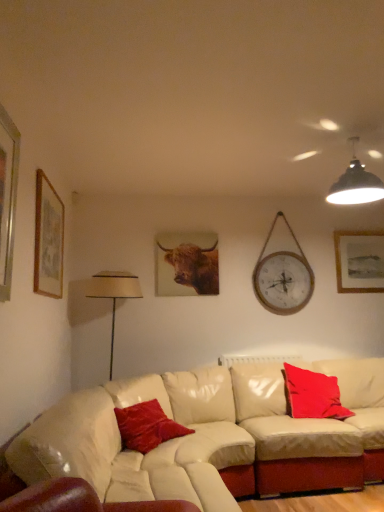
Question: From a real-world perspective, is velvet red pillow at center, which is the 2th pillow in right-to-left order, above or below silver metallic picture frame at left, placed as the second picture frame when sorted from left to right?

Choices:
 (A) below
 (B) above

Answer: (A)

Question: Looking at their shapes, would you say velvet red pillow at center, which is the 2th pillow in right-to-left order, is wider or thinner than silver metallic picture frame at left, positioned as the 3th picture frame in back-to-front order?

Choices:
 (A) wide
 (B) thin

Answer: (A)

Question: Which is farther from the brown furry cow at center?

Choices:
 (A) beige fabric lampshade at left
 (B) silver metallic picture frame at left, placed as the second picture frame when sorted from left to right
 (C) red velvet pillow at right, which is counted as the second pillow, starting from the left
 (D) wooden framed artwork at upper right, the 3th picture frame positioned from the left
 (E) wooden framed artwork at upper left, which is the 2th picture frame from back to front

Answer: (B)

Question: Considering the real-world distances, which object is closest to the red velvet pillow at right, which ranks as the first pillow in back-to-front order?

Choices:
 (A) wooden framed artwork at upper left, the 2th picture frame when ordered from front to back
 (B) velvet red pillow at center, which is counted as the 2th pillow, starting from the back
 (C) brown furry cow at center
 (D) beige fabric lampshade at left
 (E) silver metallic picture frame at left, which is the 1th picture frame from front to back

Answer: (B)